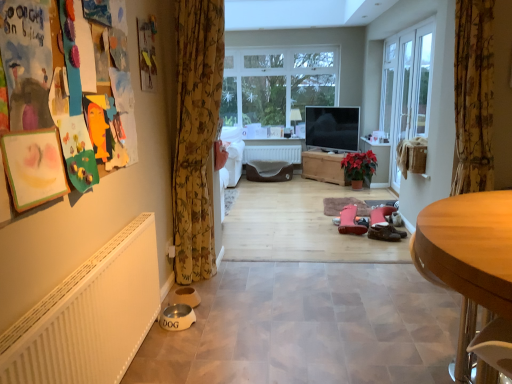
Question: From a real-world perspective, is floral fabric curtain at right, positioned as the second curtain in left-to-right order, physically located above or below pink suede boots at center, the first footwear from the back?

Choices:
 (A) above
 (B) below

Answer: (A)

Question: Is floral fabric curtain at right, positioned as the second curtain in left-to-right order, bigger or smaller than pink suede boots at center, the first footwear from the back?

Choices:
 (A) small
 (B) big

Answer: (B)

Question: Which object is positioned farthest from the white matte radiator at center?

Choices:
 (A) red matte poinsettia at center
 (B) floral fabric curtain at left, which appears as the 1th curtain when viewed from the left
 (C) white plastic lampshade at center
 (D) clear glass window at center
 (E) pink suede boots at center, the first footwear from the back

Answer: (B)

Question: Estimate the real-world distances between objects in this image. Which object is closer to the white glass screen door at right?

Choices:
 (A) white matte radiator at center
 (B) white plastic lampshade at center
 (C) wooden desk at lower right
 (D) brown leather boots at center, which is the first footwear in front-to-back order
 (E) wooden chest at center

Answer: (E)